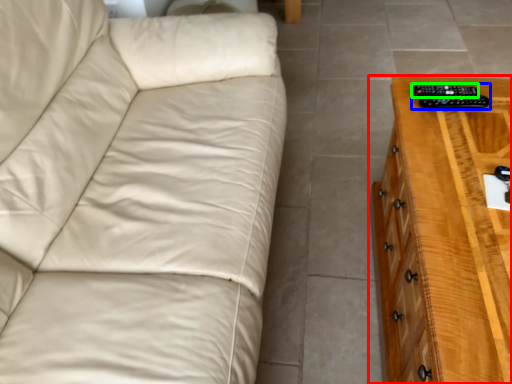
Question: Which is nearer to the chest of drawers (highlighted by a red box)? control (highlighted by a blue box) or remote (highlighted by a green box).

Choices:
 (A) control
 (B) remote

Answer: (A)